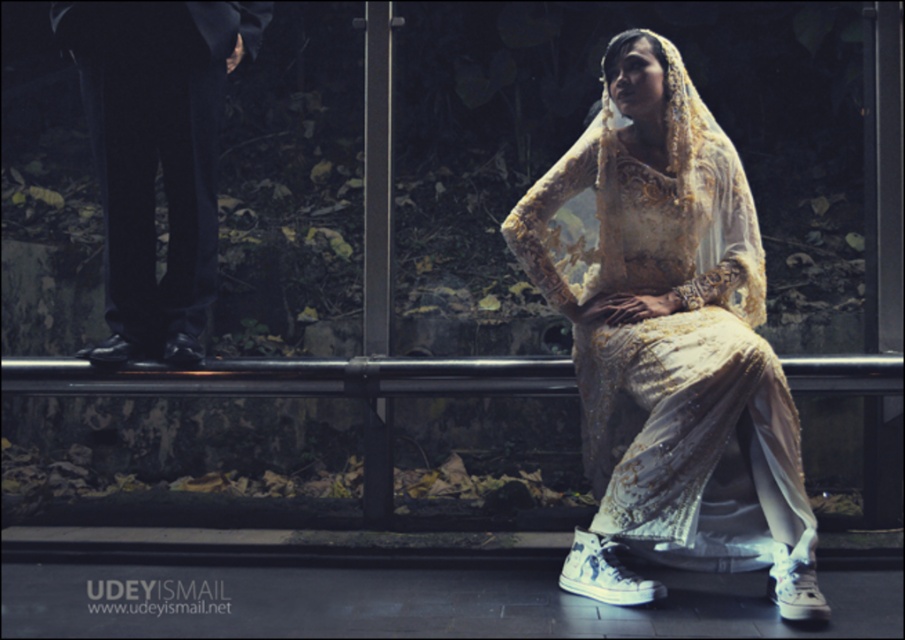
Is matte gold lace dress at center wider than black satin pants at left?

Yes.

Is matte gold lace dress at center above black satin pants at left?

Actually, matte gold lace dress at center is below black satin pants at left.

Between point (599, 120) and point (165, 49), which one is positioned in front?

Point (599, 120) is in front.

This screenshot has height=640, width=905. In order to click on matte gold lace dress at center in this screenshot , I will do `click(670, 342)`.